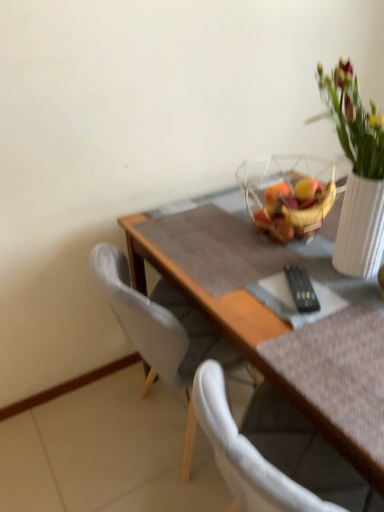
This screenshot has height=512, width=384. I want to click on wooden table at center, so click(237, 302).

The width and height of the screenshot is (384, 512). What do you see at coordinates (160, 331) in the screenshot?
I see `white fabric chair at left` at bounding box center [160, 331].

This screenshot has width=384, height=512. Identify the location of transparent glass bowl at upper right. (x=290, y=193).

Which point is more forward, (196, 366) or (305, 189)?

Point (305, 189)

Considering the relative sizes of white fabric chair at left and translucent glass bowl at upper center in the image provided, is white fabric chair at left taller than translucent glass bowl at upper center?

Yes, white fabric chair at left is taller than translucent glass bowl at upper center.

Is there a large distance between white fabric chair at left and translucent glass bowl at upper center?

No, there isn't a large distance between white fabric chair at left and translucent glass bowl at upper center.

Is white fabric chair at left facing towards translucent glass bowl at upper center?

No, white fabric chair at left does not turn towards translucent glass bowl at upper center.

Does translucent glass bowl at upper center have a lesser height compared to transparent glass bowl at upper right?

Correct, translucent glass bowl at upper center is not as tall as transparent glass bowl at upper right.

Is translucent glass bowl at upper center positioned beyond the bounds of transparent glass bowl at upper right?

Actually, translucent glass bowl at upper center is at least partially inside transparent glass bowl at upper right.

Is point (303, 198) less distant than point (275, 173)?

Yes, it is in front of point (275, 173).

Which is nearer, (305,181) or (186,317)?

Clearly, point (305,181) is closer to the camera than point (186,317).

Can you tell me how much translucent glass bowl at upper center and white fabric chair at left differ in facing direction?

90.3 degrees.

Looking at this image, is translucent glass bowl at upper center taller or shorter than white fabric chair at left?

In the image, translucent glass bowl at upper center appears to be shorter than white fabric chair at left.

Is translucent glass bowl at upper center oriented away from white fabric chair at left?

No, translucent glass bowl at upper center is not facing away from white fabric chair at left.

Consider the image. Looking at the image, does transparent glass bowl at upper right seem bigger or smaller compared to translucent glass bowl at upper center?

In the image, transparent glass bowl at upper right appears to be larger than translucent glass bowl at upper center.

Is transparent glass bowl at upper right oriented away from translucent glass bowl at upper center?

No.

Can you tell me how much transparent glass bowl at upper right and translucent glass bowl at upper center differ in facing direction?

The facing directions of transparent glass bowl at upper right and translucent glass bowl at upper center are 0.719 degrees apart.

From the image's perspective, is wooden table at center located above white fabric chair at left?

No.

In the scene shown: From a real-world perspective, which is physically above, wooden table at center or white fabric chair at left?

white fabric chair at left, from a real-world perspective.

Can you confirm if wooden table at center is shorter than white fabric chair at left?

Yes, wooden table at center is shorter than white fabric chair at left.

Consider the image. Between white fabric chair at left and transparent glass bowl at upper right, which one has larger size?

With larger size is white fabric chair at left.

Is white fabric chair at left next to transparent glass bowl at upper right?

white fabric chair at left is not next to transparent glass bowl at upper right, and they're not touching.

Considering the relative sizes of white fabric chair at left and transparent glass bowl at upper right in the image provided, is white fabric chair at left wider than transparent glass bowl at upper right?

Yes.

This screenshot has width=384, height=512. I want to click on flower behind the wooden table at center, so click(x=307, y=191).

Considering the positions of point (323, 187) and point (187, 272), is point (323, 187) closer or farther from the camera than point (187, 272)?

Point (323, 187) is farther from the camera than point (187, 272).

Is translucent glass bowl at upper center positioned before wooden table at center?

That is False.

Where is `flower on the right of the white fabric chair at left`? This screenshot has height=512, width=384. flower on the right of the white fabric chair at left is located at coordinates (307, 191).

At what (x,y) coordinates should I click in order to perform the action: click on basket below the translucent glass bowl at upper center (from a real-world perspective). Please return your answer as a coordinate pair (x, y). This screenshot has width=384, height=512. Looking at the image, I should click on (290, 193).

From the image, which object appears to be nearer to white fabric chair at left, translucent glass bowl at upper center or wooden table at center?

wooden table at center is positioned closer to the anchor white fabric chair at left.

Considering their positions, is white fabric chair at left positioned closer to translucent glass bowl at upper center than transparent glass bowl at upper right?

Among the two, transparent glass bowl at upper right is located nearer to translucent glass bowl at upper center.

From the image, which object appears to be farther from white fabric chair at left, transparent glass bowl at upper right or translucent glass bowl at upper center?

translucent glass bowl at upper center is further to white fabric chair at left.

From the image, which object appears to be farther from white fabric chair at left, transparent glass bowl at upper right or wooden table at center?

The object further to white fabric chair at left is transparent glass bowl at upper right.

Looking at the image, which one is located further to wooden table at center, white fabric chair at left or transparent glass bowl at upper right?

transparent glass bowl at upper right lies further to wooden table at center than the other object.

When comparing their distances from translucent glass bowl at upper center, does white fabric chair at left or wooden table at center seem further?

white fabric chair at left is further to translucent glass bowl at upper center.

Estimate the real-world distances between objects in this image. Which object is closer to transparent glass bowl at upper right, wooden table at center or translucent glass bowl at upper center?

The object closer to transparent glass bowl at upper right is translucent glass bowl at upper center.

Based on their spatial positions, is transparent glass bowl at upper right or white fabric chair at left closer to wooden table at center?

white fabric chair at left is positioned closer to the anchor wooden table at center.

Locate an element on the screen. The height and width of the screenshot is (512, 384). basket between translucent glass bowl at upper center and white fabric chair at left in the vertical direction is located at coordinates (290, 193).

This screenshot has width=384, height=512. In order to click on basket between wooden table at center and translucent glass bowl at upper center in the front-back direction in this screenshot , I will do `click(290, 193)`.

Locate an element on the screen. chair between transparent glass bowl at upper right and wooden table at center in the vertical direction is located at coordinates (160, 331).

What are the coordinates of `chair between translucent glass bowl at upper center and wooden table at center in the up-down direction` in the screenshot? It's located at (160, 331).